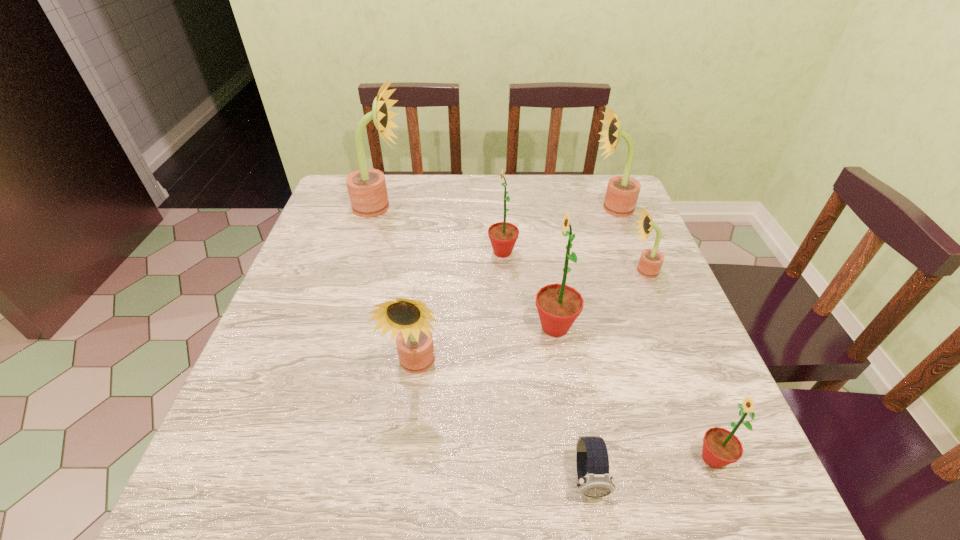
This screenshot has width=960, height=540. Identify the location of the nearest sunflower. (721, 447).

The image size is (960, 540). In order to click on the nearest green sunflower in this screenshot , I will do `click(721, 447)`.

Find the location of a particular element. The height and width of the screenshot is (540, 960). dark watch is located at coordinates (592, 460).

This screenshot has width=960, height=540. I want to click on the shortest object, so click(x=592, y=460).

You are a GUI agent. You are given a task and a screenshot of the screen. Output one action in this format:
    pyautogui.click(x=<x>, y=<y>)
    Task: Click on the free point located on the face of the leftmost object
    
    Given the screenshot: What is the action you would take?
    pyautogui.click(x=426, y=207)

This screenshot has width=960, height=540. I want to click on vacant space situated 0.130m on the face of the third smallest yellow sunflower, so [x=545, y=208].

Where is `vacant space situated on the face of the third smallest yellow sunflower`? vacant space situated on the face of the third smallest yellow sunflower is located at coordinates (535, 208).

This screenshot has width=960, height=540. I want to click on vacant space located 0.150m on the face of the third smallest yellow sunflower, so click(538, 208).

In order to click on vacant space located 0.380m on the face of the biggest green sunflower in this screenshot , I will do `click(356, 327)`.

Find the location of a particular element. vacant space located 0.350m on the face of the biggest green sunflower is located at coordinates (370, 327).